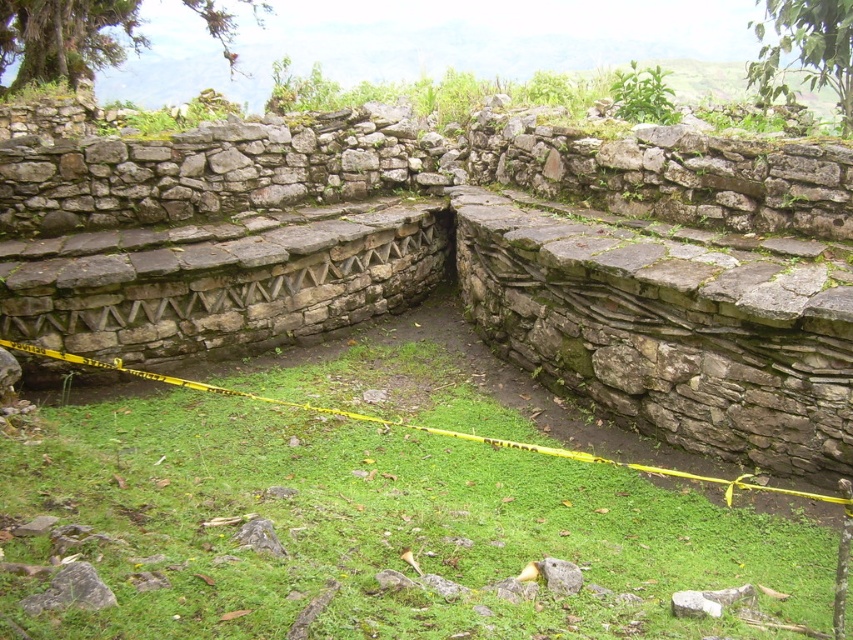
What is the 2D coordinate of the natural stone wall at center?

The natural stone wall at center is located at the 2D coordinate point of [462,260].

You are standing in front of the ancient stone structure and want to know which of the two points, point (815, 429) or point (781, 609), is closer to you. Can you determine this based on their positions?

Point (815, 429) is closer to you because it is further to the viewer than point (781, 609).

From the picture: You are a hiker standing in the archaeological site. You notice the natural stone wall at center and the green grass at center. Which one is shorter in height?

The natural stone wall at center is not as tall as green grass at center, so the natural stone wall at center is shorter in height.